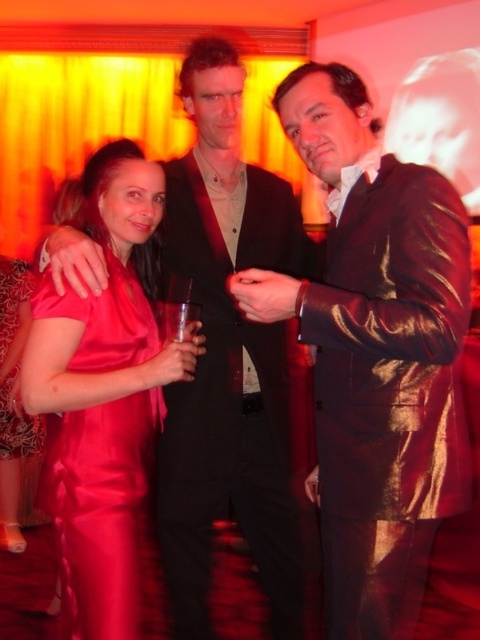
Question: Can you confirm if satin dress at left is thinner than satin dress at center?

Choices:
 (A) yes
 (B) no

Answer: (B)

Question: In this image, where is shiny leather jacket at center located relative to black satin suit at center?

Choices:
 (A) below
 (B) above

Answer: (B)

Question: Which object appears closest to the camera in this image?

Choices:
 (A) satin dress at center
 (B) shiny leather jacket at center

Answer: (B)

Question: Which point is farther to the camera?

Choices:
 (A) shiny leather jacket at center
 (B) satin dress at center
 (C) satin dress at left
 (D) black satin suit at center

Answer: (B)

Question: Is matte black suit at center bigger than satin dress at center?

Choices:
 (A) no
 (B) yes

Answer: (B)

Question: Among these points, which one is farthest from the camera?

Choices:
 (A) (130, 397)
 (B) (285, 573)
 (C) (437, 388)
 (D) (63, 241)

Answer: (B)